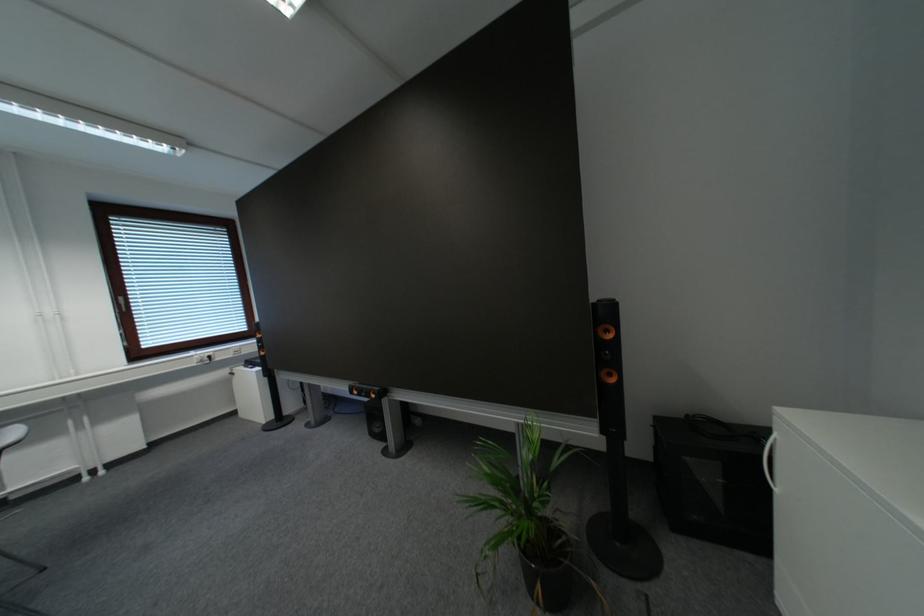
Identify the location of white cabinet handle. The height and width of the screenshot is (616, 924). (768, 460).